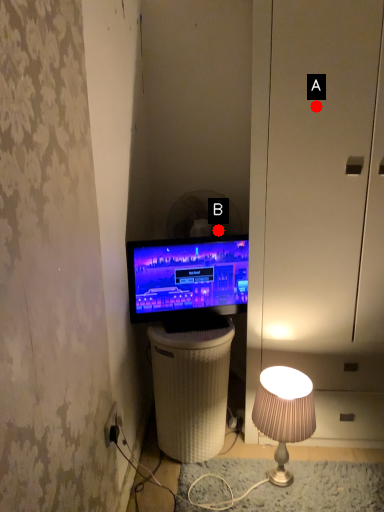
Question: Two points are circled on the image, labeled by A and B beside each circle. Which point is closer to the camera?

Choices:
 (A) A is closer
 (B) B is closer

Answer: (A)